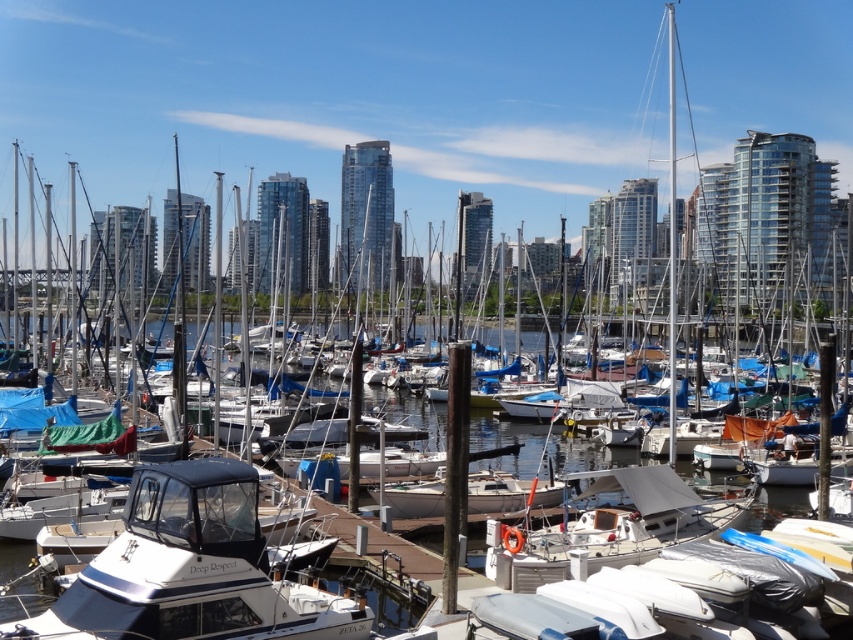
You are standing at the edge of the marina looking out at the boats. There are two points marked on the water surface, one at point coordinates point (198, 490) and the other at point coordinates point (312, 614). Which point is closer to you?

Point (198, 490) is closer to the camera than point (312, 614), so the point at coordinates point (198, 490) is closer to you.

You are a photographer planning to take a photo of the clear water at center and the white glossy boat at center from the dock. Based on their heights, which object will appear taller in the photo?

The clear water at center appears taller in the photo because it has a greater height compared to the white glossy boat at center according to the description.

You are a photographer planning to capture the reflection of the white matte sailboat at center in the clear water at center. Based on the scene, can you confirm if the reflection will be visible?

The clear water at center is above the white matte sailboat at center, so the reflection of the white matte sailboat at center would not be visible because the water is above the boat, which is an unusual spatial arrangement.